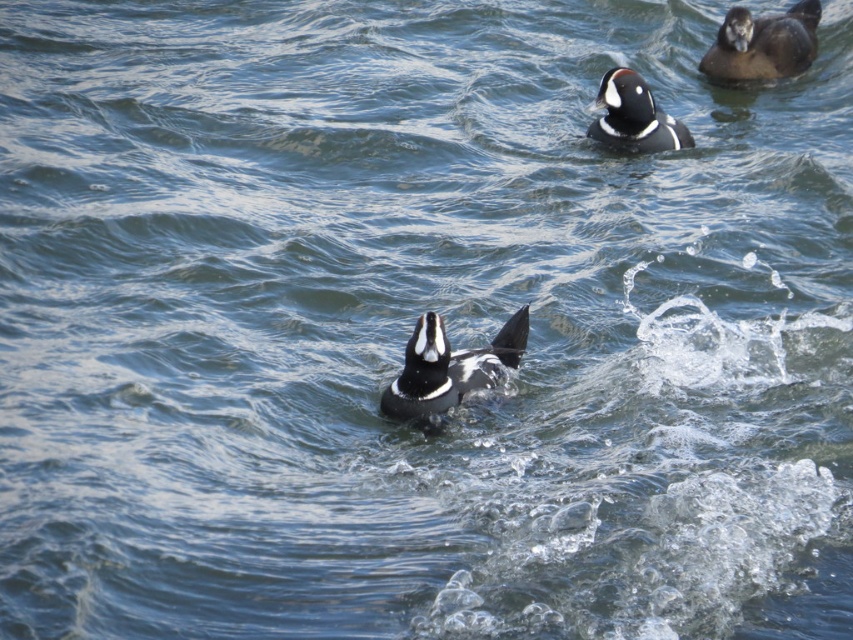
Question: Does brown matte duck at upper right appear on the right side of black glossy duck at upper center?

Choices:
 (A) yes
 (B) no

Answer: (A)

Question: Based on their relative distances, which object is farther from the black glossy duck at upper center?

Choices:
 (A) brown matte duck at upper right
 (B) black and white duck at center

Answer: (B)

Question: Which of these objects is positioned closest to the black glossy duck at upper center?

Choices:
 (A) black and white duck at center
 (B) brown matte duck at upper right

Answer: (B)

Question: Can you confirm if brown matte duck at upper right is positioned below black glossy duck at upper center?

Choices:
 (A) yes
 (B) no

Answer: (B)

Question: Among these objects, which one is nearest to the camera?

Choices:
 (A) black and white duck at center
 (B) brown matte duck at upper right
 (C) black glossy duck at upper center

Answer: (A)

Question: Is the position of black and white duck at center more distant than that of black glossy duck at upper center?

Choices:
 (A) yes
 (B) no

Answer: (B)